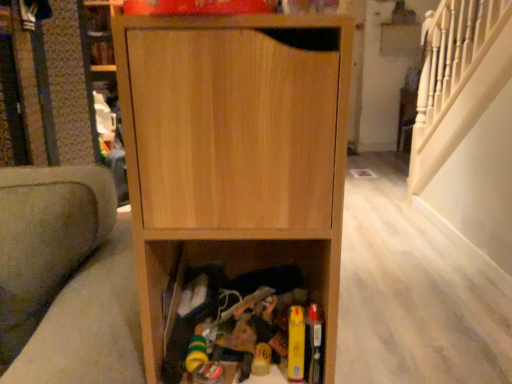
Question: Is natural wood cabinet at center at the right side of soft gray fabric armchair at left?

Choices:
 (A) yes
 (B) no

Answer: (A)

Question: Is natural wood cabinet at center at the left side of soft gray fabric armchair at left?

Choices:
 (A) yes
 (B) no

Answer: (B)

Question: From the image's perspective, is natural wood cabinet at center under soft gray fabric armchair at left?

Choices:
 (A) yes
 (B) no

Answer: (B)

Question: From the image's perspective, would you say natural wood cabinet at center is positioned over soft gray fabric armchair at left?

Choices:
 (A) yes
 (B) no

Answer: (A)

Question: From a real-world perspective, is natural wood cabinet at center over soft gray fabric armchair at left?

Choices:
 (A) yes
 (B) no

Answer: (A)

Question: Can soft gray fabric armchair at left be found inside natural wood cabinet at center?

Choices:
 (A) yes
 (B) no

Answer: (B)

Question: Could natural wood cabinet at center be considered to be inside soft gray fabric armchair at left?

Choices:
 (A) yes
 (B) no

Answer: (B)

Question: Is soft gray fabric armchair at left completely or partially outside of natural wood cabinet at center?

Choices:
 (A) no
 (B) yes

Answer: (B)

Question: Is soft gray fabric armchair at left not close to natural wood cabinet at center?

Choices:
 (A) no
 (B) yes

Answer: (A)

Question: Can you confirm if soft gray fabric armchair at left is smaller than natural wood cabinet at center?

Choices:
 (A) no
 (B) yes

Answer: (A)

Question: From the image's perspective, is soft gray fabric armchair at left on natural wood cabinet at center?

Choices:
 (A) yes
 (B) no

Answer: (B)

Question: From the image's perspective, does soft gray fabric armchair at left appear lower than natural wood cabinet at center?

Choices:
 (A) no
 (B) yes

Answer: (B)

Question: Is natural wood cabinet at center taller or shorter than soft gray fabric armchair at left?

Choices:
 (A) short
 (B) tall

Answer: (A)